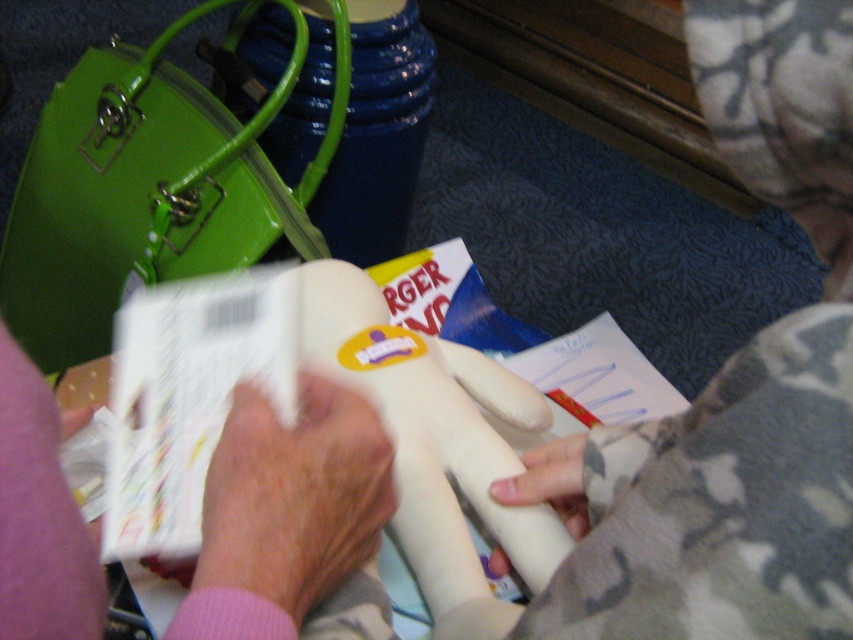
Question: Observing the image, what is the correct spatial positioning of pink fabric at center in reference to white matte foam at center?

Choices:
 (A) right
 (B) left

Answer: (B)

Question: Does pink fabric at center come in front of white matte foam at center?

Choices:
 (A) yes
 (B) no

Answer: (A)

Question: Which point is closer to the camera taking this photo?

Choices:
 (A) (355, 435)
 (B) (500, 483)

Answer: (A)

Question: Can you confirm if pink fabric at center is positioned to the left of white matte foam at center?

Choices:
 (A) no
 (B) yes

Answer: (B)

Question: Which object is farther from the camera taking this photo?

Choices:
 (A) pink fabric at center
 (B) white matte foam at center

Answer: (B)

Question: Which point is closer to the camera?

Choices:
 (A) (540, 490)
 (B) (310, 605)

Answer: (B)